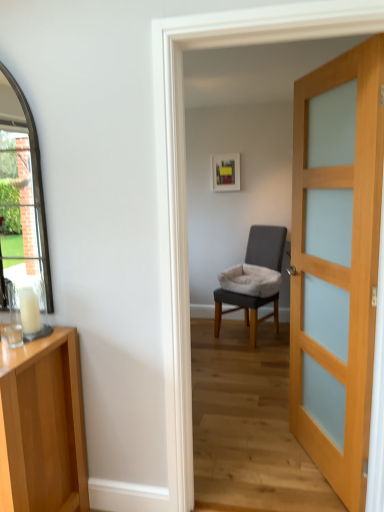
Question: From the image's perspective, would you say gray fabric chair at center is shown under wooden door at right?

Choices:
 (A) yes
 (B) no

Answer: (A)

Question: Would you say gray fabric chair at center is a long distance from wooden door at right?

Choices:
 (A) yes
 (B) no

Answer: (A)

Question: Does gray fabric chair at center have a greater height compared to wooden door at right?

Choices:
 (A) no
 (B) yes

Answer: (A)

Question: Can we say gray fabric chair at center lies outside wooden door at right?

Choices:
 (A) no
 (B) yes

Answer: (B)

Question: Is wooden door at right located within gray fabric chair at center?

Choices:
 (A) yes
 (B) no

Answer: (B)

Question: Is gray fabric chair at center inside the boundaries of light wood cabinet at left, or outside?

Choices:
 (A) outside
 (B) inside

Answer: (A)

Question: Looking at the image, does gray fabric chair at center seem bigger or smaller compared to light wood cabinet at left?

Choices:
 (A) small
 (B) big

Answer: (B)

Question: Does point (231, 295) appear closer or farther from the camera than point (52, 448)?

Choices:
 (A) farther
 (B) closer

Answer: (A)

Question: In terms of height, does gray fabric chair at center look taller or shorter compared to light wood cabinet at left?

Choices:
 (A) short
 (B) tall

Answer: (B)

Question: From their relative heights in the image, would you say wooden door at right is taller or shorter than gray fabric chair at center?

Choices:
 (A) tall
 (B) short

Answer: (A)

Question: In the image, is wooden door at right positioned in front of or behind gray fabric chair at center?

Choices:
 (A) front
 (B) behind

Answer: (A)

Question: Would you say wooden door at right is inside or outside gray fabric chair at center?

Choices:
 (A) outside
 (B) inside

Answer: (A)

Question: From the image's perspective, is wooden door at right above or below gray fabric chair at center?

Choices:
 (A) below
 (B) above

Answer: (B)

Question: Is light wood cabinet at left bigger or smaller than gray fabric chair at center?

Choices:
 (A) small
 (B) big

Answer: (A)

Question: Is point (59, 371) closer or farther from the camera than point (228, 298)?

Choices:
 (A) closer
 (B) farther

Answer: (A)